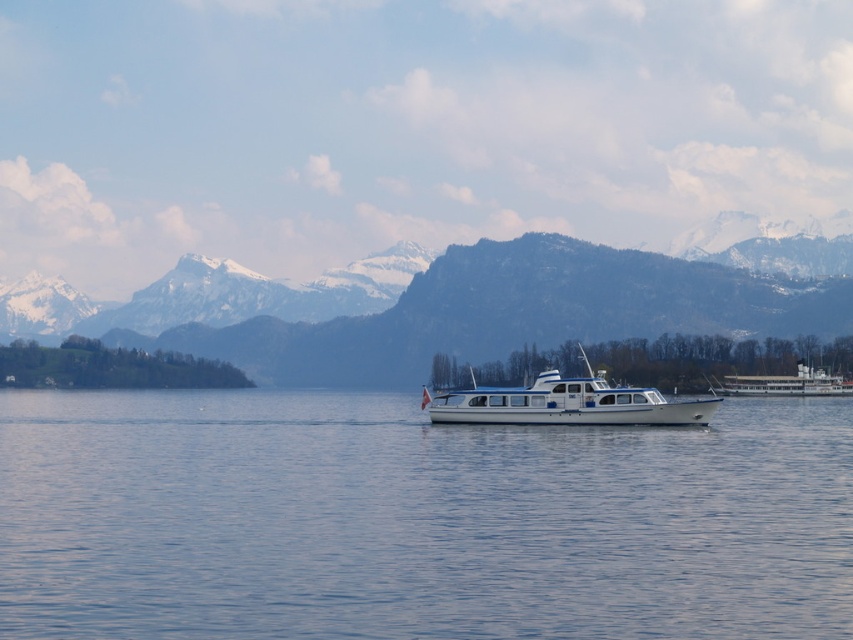
Question: Does snowy rock mountain range at left have a smaller size compared to white glossy boat at center?

Choices:
 (A) yes
 (B) no

Answer: (B)

Question: Which object appears closest to the camera in this image?

Choices:
 (A) snowy rock mountain range at left
 (B) white glossy boat at center

Answer: (B)

Question: Does snowy rock mountain range at left lie in front of white glossy boat at center?

Choices:
 (A) no
 (B) yes

Answer: (A)

Question: Which point appears farthest from the camera in this image?

Choices:
 (A) (456, 390)
 (B) (506, 504)
 (C) (300, 358)

Answer: (C)

Question: Among these objects, which one is farthest from the camera?

Choices:
 (A) blue water at center
 (B) snowy rock mountain range at left
 (C) white glossy boat at center

Answer: (B)

Question: Does blue water at center have a larger size compared to snowy rock mountain range at left?

Choices:
 (A) no
 (B) yes

Answer: (A)